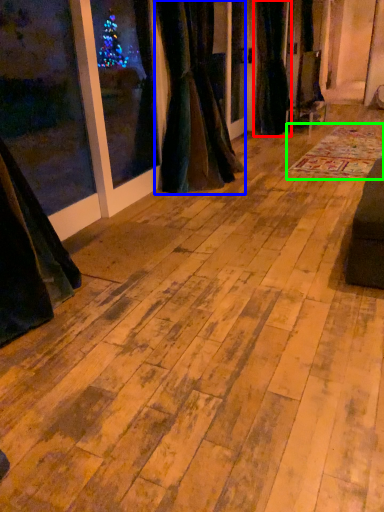
Question: Which object is positioned farthest from curtain (highlighted by a red box)? Select from curtain (highlighted by a blue box) and mat (highlighted by a green box).

Choices:
 (A) curtain
 (B) mat

Answer: (A)